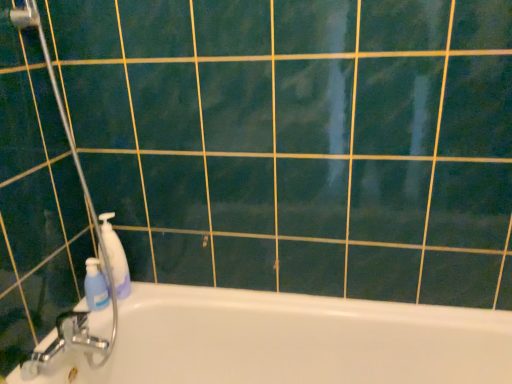
Question: Does white glossy bathtub at lower left lie behind transparent plastic shower door at left?

Choices:
 (A) no
 (B) yes

Answer: (A)

Question: Is white glossy bathtub at lower left looking in the opposite direction of transparent plastic shower door at left?

Choices:
 (A) no
 (B) yes

Answer: (A)

Question: Considering the relative positions of white glossy bathtub at lower left and transparent plastic shower door at left in the image provided, is white glossy bathtub at lower left to the left of transparent plastic shower door at left from the viewer's perspective?

Choices:
 (A) no
 (B) yes

Answer: (A)

Question: Is white glossy bathtub at lower left outside of transparent plastic shower door at left?

Choices:
 (A) yes
 (B) no

Answer: (A)

Question: From a real-world perspective, is white glossy bathtub at lower left under transparent plastic shower door at left?

Choices:
 (A) yes
 (B) no

Answer: (A)

Question: Considering the positions of white glossy bathtub at lower left and transparent plastic shower door at left in the image, is white glossy bathtub at lower left taller or shorter than transparent plastic shower door at left?

Choices:
 (A) tall
 (B) short

Answer: (B)

Question: From the image's perspective, is white glossy bathtub at lower left above or below transparent plastic shower door at left?

Choices:
 (A) below
 (B) above

Answer: (A)

Question: Is point (337, 375) positioned closer to the camera than point (31, 365)?

Choices:
 (A) farther
 (B) closer

Answer: (A)

Question: From a real-world perspective, relative to transparent plastic shower door at left, is white glossy bathtub at lower left vertically above or below?

Choices:
 (A) below
 (B) above

Answer: (A)

Question: From the image's perspective, is blue plastic pump bottle at left, which is the 1th cleaning product from right to left, positioned above or below blue plastic bottle at left, marked as the 1th cleaning product in a left-to-right arrangement?

Choices:
 (A) above
 (B) below

Answer: (A)

Question: Is blue plastic pump bottle at left, which is the 1th cleaning product from right to left, in front of or behind blue plastic bottle at left, marked as the 1th cleaning product in a left-to-right arrangement, in the image?

Choices:
 (A) behind
 (B) front

Answer: (B)

Question: In the image, is blue plastic pump bottle at left, which is the 1th cleaning product from right to left, on the left side or the right side of blue plastic bottle at left, marked as the 1th cleaning product in a left-to-right arrangement?

Choices:
 (A) left
 (B) right

Answer: (B)

Question: Is point (125, 276) positioned closer to the camera than point (99, 302)?

Choices:
 (A) closer
 (B) farther

Answer: (B)

Question: Based on their positions, is blue plastic bottle at left, marked as the 1th cleaning product in a left-to-right arrangement, located to the left or right of white glossy bathtub at lower left?

Choices:
 (A) left
 (B) right

Answer: (A)

Question: From the image's perspective, relative to white glossy bathtub at lower left, is blue plastic bottle at left, marked as the 1th cleaning product in a left-to-right arrangement, above or below?

Choices:
 (A) above
 (B) below

Answer: (A)